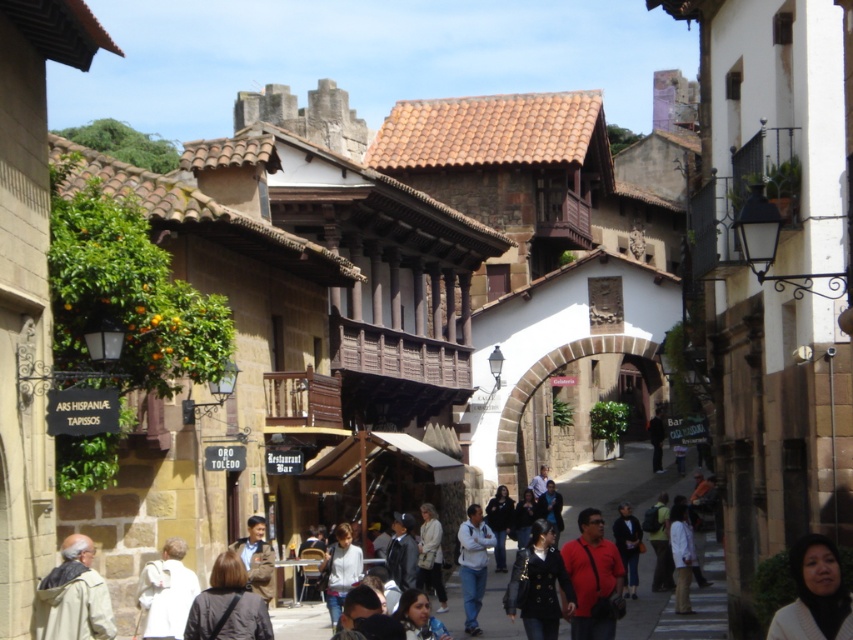
Question: Estimate the real-world distances between objects in this image. Which object is closer to the brown leather jacket at center?

Choices:
 (A) light beige jacket at lower left
 (B) dark brown leather jacket at lower left
 (C) light beige sweater at center
 (D) matte red shirt at center

Answer: (B)

Question: Does brown stone archway at center appear on the left side of white matte jacket at lower left?

Choices:
 (A) yes
 (B) no

Answer: (B)

Question: Does smooth beige sweater at lower right appear on the right side of white cotton shirt at center?

Choices:
 (A) yes
 (B) no

Answer: (A)

Question: Among these objects, which one is farthest from the camera?

Choices:
 (A) matte red shirt at center
 (B) white cotton shirt at center

Answer: (B)

Question: Can you confirm if denim jeans at center is positioned to the left of white cotton shirt at center?

Choices:
 (A) yes
 (B) no

Answer: (B)

Question: Based on their relative distances, which object is farther from the brown stone archway at center?

Choices:
 (A) black leather jacket at center
 (B) matte red shirt at center
 (C) dark brown leather jacket at lower left
 (D) light beige sweater at center

Answer: (C)